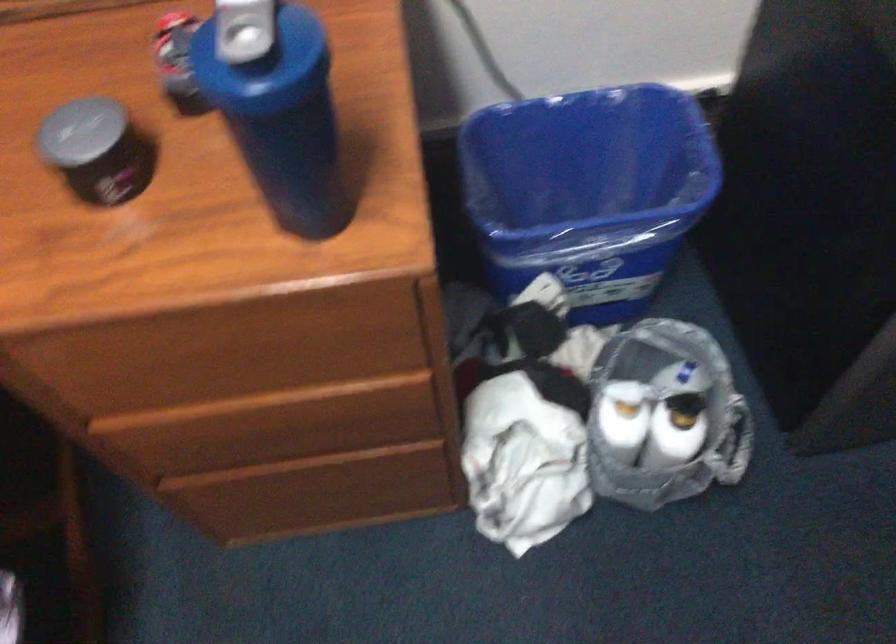
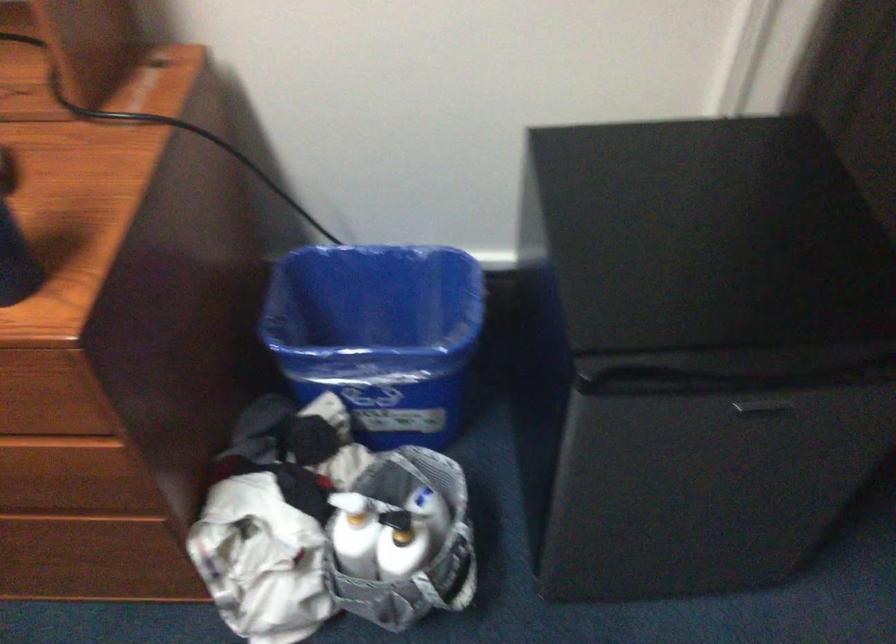
Where in the second image is the point corresponding to point 346,471 from the first image?

(83, 533)